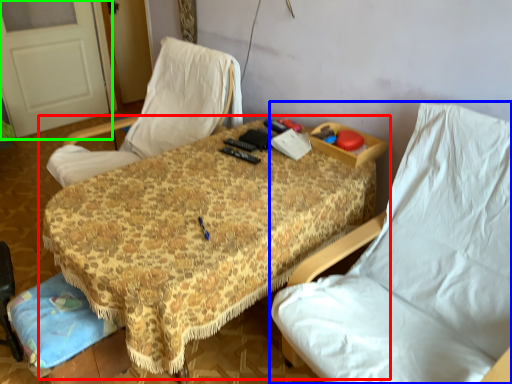
Question: Estimate the real-world distances between objects in this image. Which object is closer to table (highlighted by a red box), chair (highlighted by a blue box) or door (highlighted by a green box)?

Choices:
 (A) chair
 (B) door

Answer: (A)